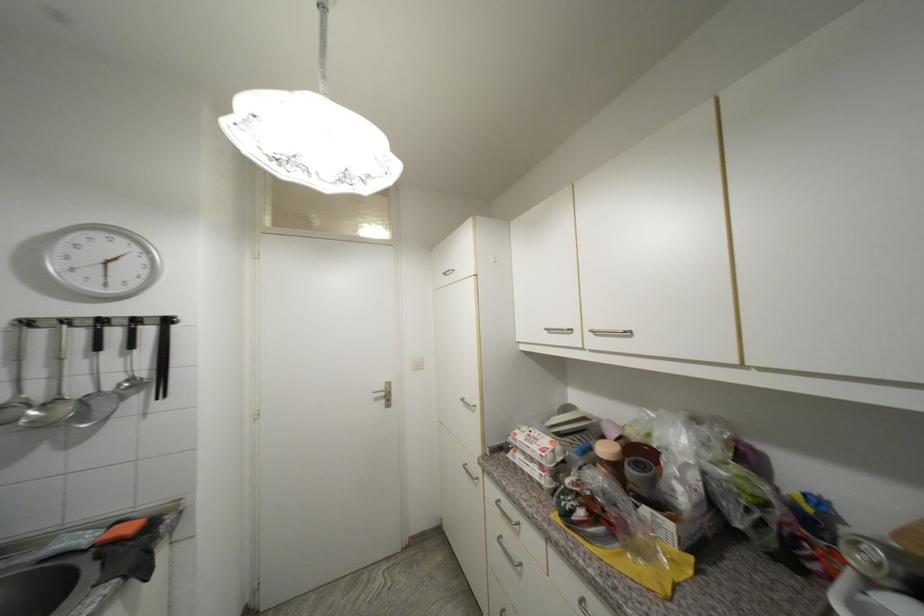
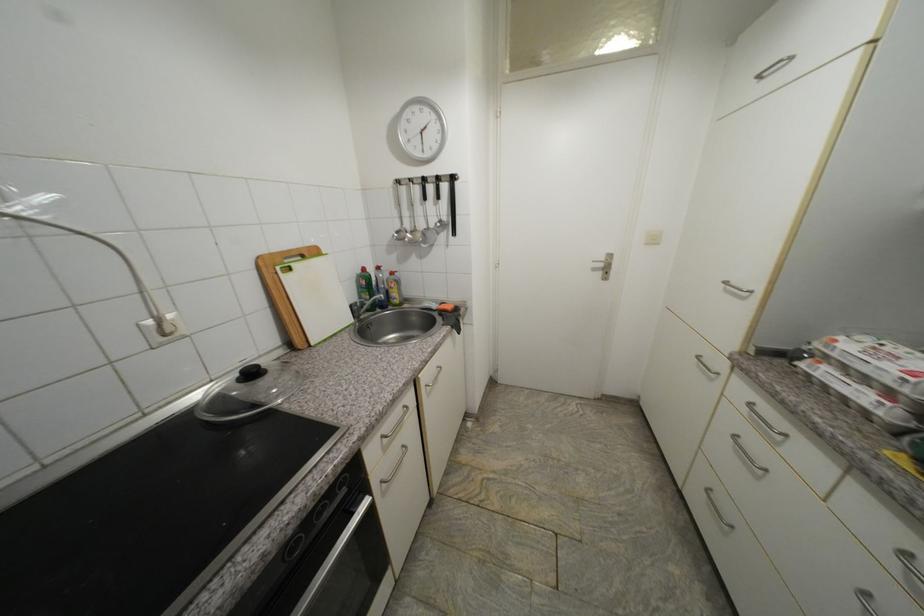
How did the camera likely rotate?

The camera rotated toward left-down.